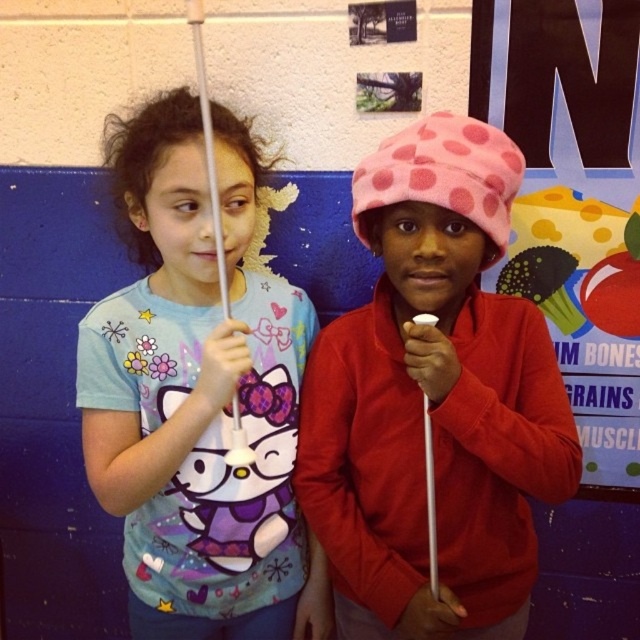
You are a delivery robot with a width of 10 inches. You need to pass through a narrow space between the pink fleece hat at center and the matte white cane at center. Can you fit through this space?

The distance between the pink fleece hat at center and the matte white cane at center is 9.67 inches, which is narrower than the robot width of 10 inches. Therefore, the robot cannot fit through this space.

You are a visitor in a classroom and need to locate the polka dot fabric hat at upper right. Which direction should you look relative to the matte white cane at center?

The matte white cane at center is to the left of the polka dot fabric hat at upper right, so you should look to the right of the matte white cane at center to find the polka dot fabric hat at upper right.

You are a teacher in a classroom. You see the pink fleece hat at center and the matte white cane at center. Which object is positioned to the right of the other?

The pink fleece hat at center is to the right of the matte white cane at center.